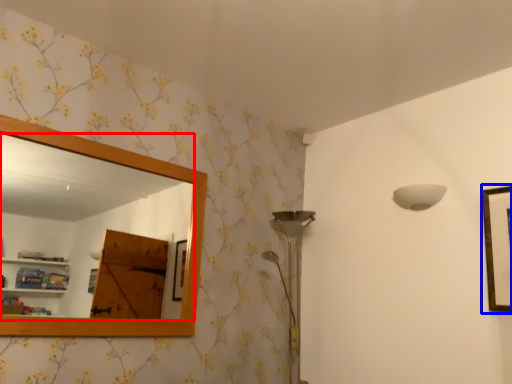
Question: Which object appears closest to the camera in this image, mirror (highlighted by a red box) or picture frame (highlighted by a blue box)?

Choices:
 (A) mirror
 (B) picture frame

Answer: (A)